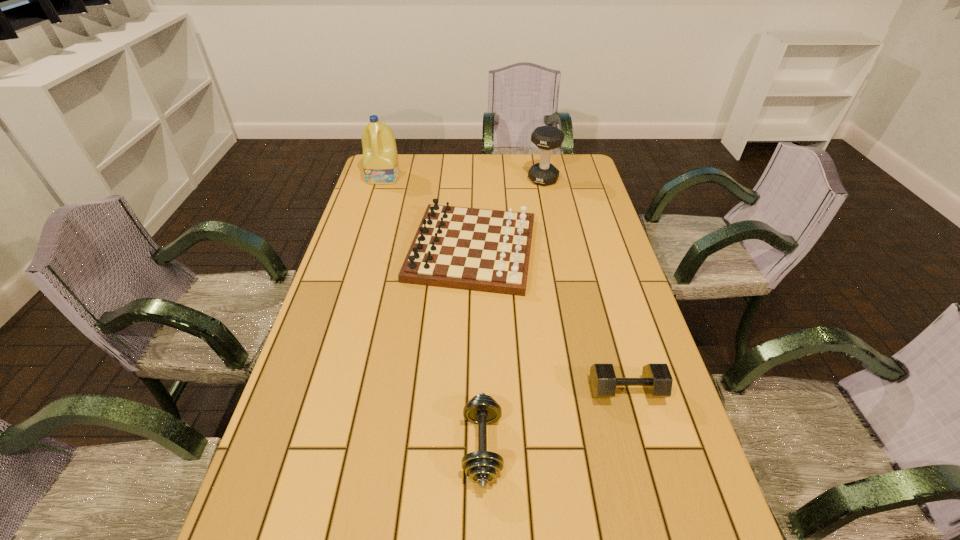
Find the location of a particular element. The image size is (960, 540). detergent is located at coordinates (380, 159).

The height and width of the screenshot is (540, 960). What are the coordinates of `the tallest object` in the screenshot? It's located at coord(380,159).

Where is `the tallest dumbbell`? The image size is (960, 540). the tallest dumbbell is located at coordinates (546, 138).

The height and width of the screenshot is (540, 960). What are the coordinates of `the farthest dumbbell` in the screenshot? It's located at (546, 138).

I want to click on the third farthest object, so click(x=484, y=250).

Image resolution: width=960 pixels, height=540 pixels. Find the location of `the leftmost dumbbell`. the leftmost dumbbell is located at coordinates tap(482, 467).

Image resolution: width=960 pixels, height=540 pixels. What are the coordinates of `vacant point located on the label of the detergent` in the screenshot? It's located at (378, 195).

This screenshot has height=540, width=960. I want to click on vacant space located 0.390m on the front of the farthest dumbbell, so click(x=558, y=253).

I want to click on vacant space located on the front of the third nearest object, so click(469, 346).

Find the location of a particular element. Image resolution: width=960 pixels, height=540 pixels. blank area located 0.230m on the right of the leftmost dumbbell is located at coordinates (610, 447).